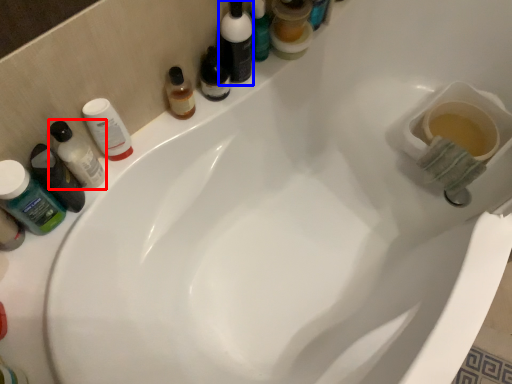
Question: Among these objects, which one is farthest to the camera, mouthwash (highlighted by a red box) or toiletry (highlighted by a blue box)?

Choices:
 (A) mouthwash
 (B) toiletry

Answer: (B)